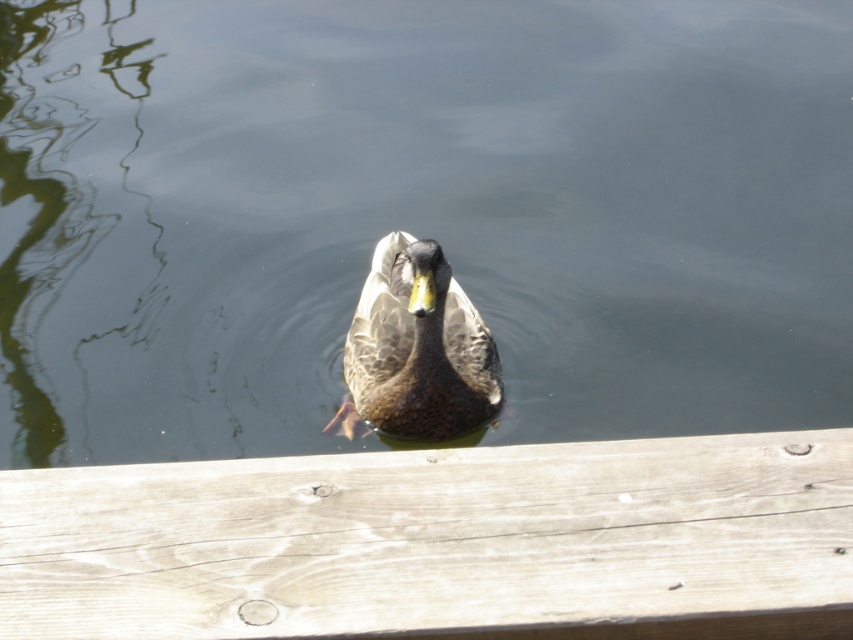
You are an observer standing on the wooden dock looking at the light brown wood at center and the brown speckled duck at center. Which object appears closer to you?

The light brown wood at center appears closer to you because it is positioned in the foreground, while the brown speckled duck at center is further away in the water.